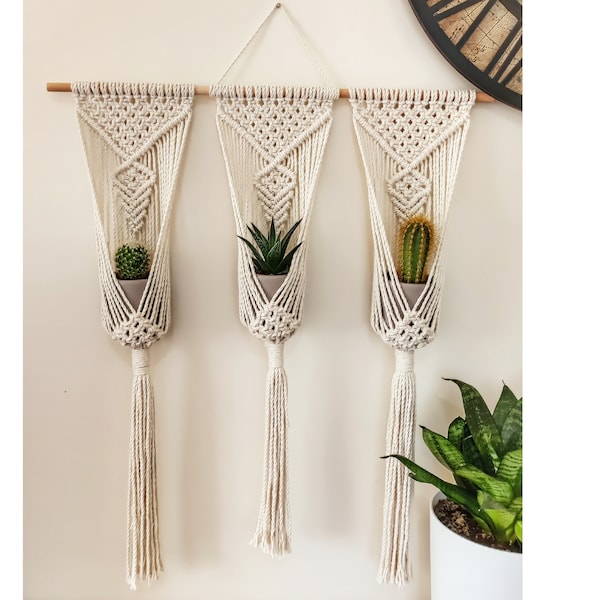
The width and height of the screenshot is (600, 600). I want to click on brown hanger, so click(62, 89).